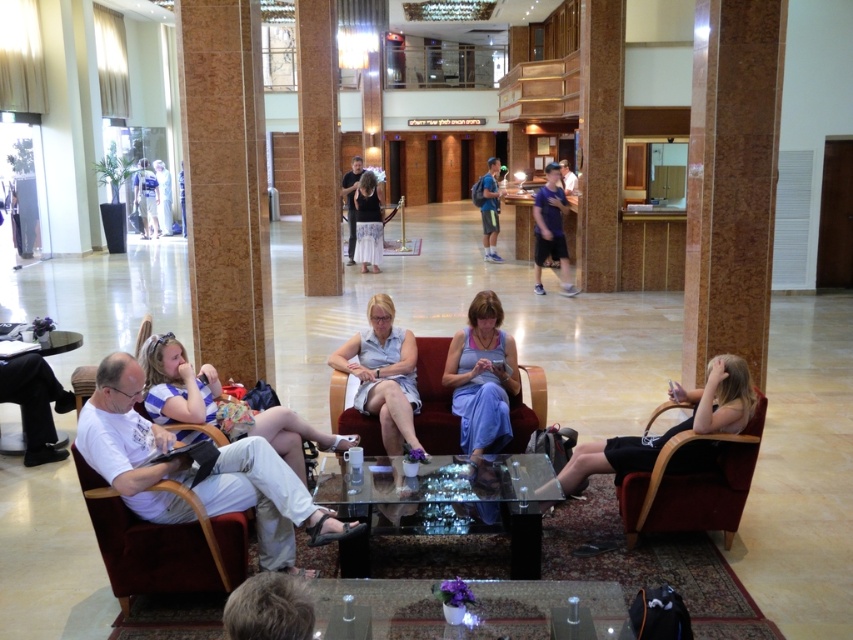
Which is more to the left, white cotton shirt at center or transparent glass table at center?

From the viewer's perspective, white cotton shirt at center appears more on the left side.

Can you confirm if white cotton shirt at center is positioned above transparent glass table at center?

Correct, white cotton shirt at center is located above transparent glass table at center.

The width and height of the screenshot is (853, 640). What do you see at coordinates (196, 472) in the screenshot?
I see `white cotton shirt at center` at bounding box center [196, 472].

Where is `white cotton shirt at center`? The height and width of the screenshot is (640, 853). white cotton shirt at center is located at coordinates (196, 472).

Based on the photo, between black fabric dress at lower right and dark gray pants at center, which one is positioned higher?

dark gray pants at center is higher up.

Who is more distant from viewer, (590, 449) or (347, 208)?

The point (347, 208) is more distant.

In the scene shown: Who is more forward, (711, 442) or (351, 253)?

Positioned in front is point (711, 442).

I want to click on black fabric dress at lower right, so click(670, 428).

Does light blue fabric dress at center have a lesser width compared to dark brown hair at lower left?

In fact, light blue fabric dress at center might be wider than dark brown hair at lower left.

Is point (413, 339) in front of point (296, 618)?

No, it is not.

Describe the element at coordinates (384, 376) in the screenshot. This screenshot has height=640, width=853. I see `light blue fabric dress at center` at that location.

Identify the location of light blue fabric dress at center. (384, 376).